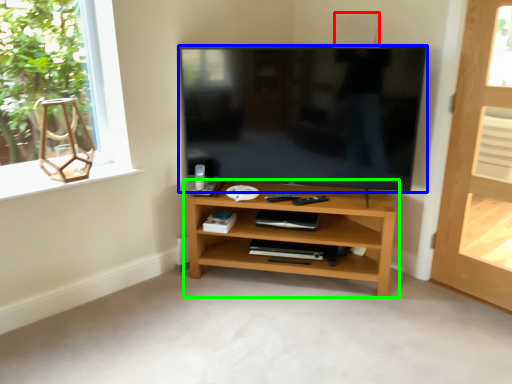
Question: Based on their relative distances, which object is nearer to speaker (highlighted by a red box)? Choose from television (highlighted by a blue box) and shelf (highlighted by a green box).

Choices:
 (A) television
 (B) shelf

Answer: (A)